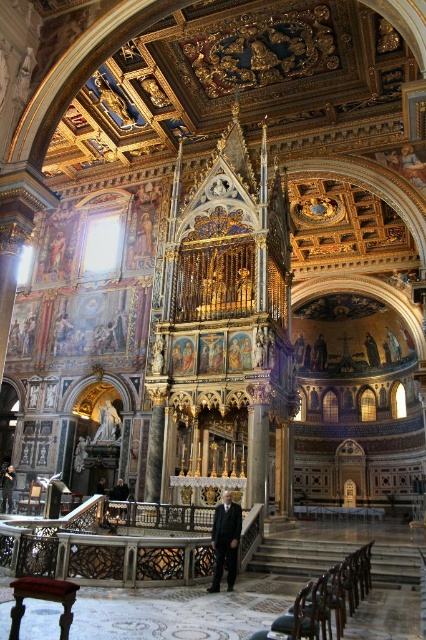
You are standing in the grand cathedral and want to walk from your current position to the exit located at point (11, 488). There is an obstacle at point (219, 580). Will you need to go around the obstacle to reach the exit?

Point (219, 580) is in front of point (11, 488), so you will need to go around the obstacle at point (219, 580) to reach the exit located at (11, 488).

You are attending a solemn ceremony in this grand cathedral and notice two attendees wearing suits at the center. Which of the two, the black suit at center or the dark suit at center, is taller?

The black suit at center is taller than the dark suit at center.

You are standing at the entrance of the grand cathedral and see two suits at the center. The black suit at center and the dark suit at center. Which one is closer to you?

The black suit at center and dark suit at center are actually the same object. The distance between them is 124.97 feet, which suggests they might be duplicates or a mirage, but since they are both at the center, they are likely the same suit viewed from different angles or a reflection. Therefore, neither is closer as they are the same.